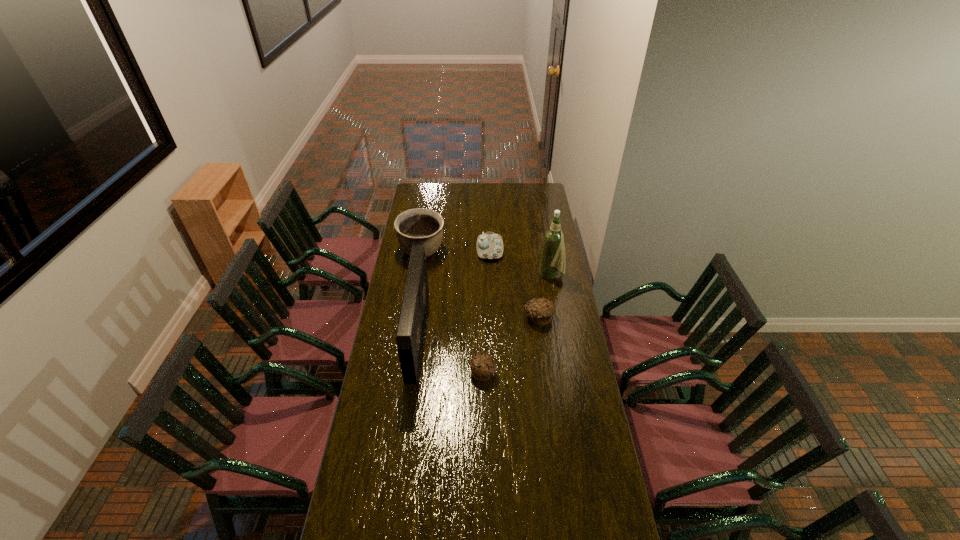
Image resolution: width=960 pixels, height=540 pixels. What are the coordinates of `wine bottle that is at the right edge` in the screenshot? It's located at (553, 255).

The width and height of the screenshot is (960, 540). Find the location of `free region at the far edge of the desktop`. free region at the far edge of the desktop is located at coordinates (497, 199).

Locate an element on the screen. This screenshot has width=960, height=540. free space at the near edge is located at coordinates (493, 537).

In the image, there is a desktop. Identify the location of vacant space at the left edge. (x=387, y=389).

Image resolution: width=960 pixels, height=540 pixels. What are the coordinates of `free region at the far left corner of the desktop` in the screenshot? It's located at (436, 189).

I want to click on empty space between the videotape and the tallest object, so click(x=485, y=305).

At what (x,y) coordinates should I click in order to perform the action: click on vacant area that lies between the shortest object and the third tallest object. Please return your answer as a coordinate pair (x, y). Looking at the image, I should click on (452, 312).

Identify the location of empty space that is in between the third tallest object and the shortest object. The width and height of the screenshot is (960, 540). (452, 312).

Image resolution: width=960 pixels, height=540 pixels. I want to click on free spot between the farther muffin and the chinaware, so click(515, 284).

Find the location of `free area in between the shorter muffin and the third tallest object`. free area in between the shorter muffin and the third tallest object is located at coordinates (452, 312).